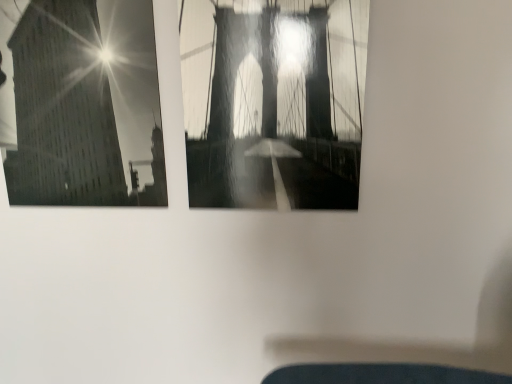
Question: From a real-world perspective, is metallic bridge at center, the second window in the left-to-right sequence, located beneath smooth glass building at upper left, the 1th window in the left-to-right sequence?

Choices:
 (A) yes
 (B) no

Answer: (A)

Question: From a real-world perspective, is metallic bridge at center, marked as the 1th window in a right-to-left arrangement, over smooth glass building at upper left, which appears as the second window when viewed from the right?

Choices:
 (A) no
 (B) yes

Answer: (A)

Question: Considering the relative sizes of metallic bridge at center, the second window in the left-to-right sequence, and smooth glass building at upper left, the 1th window in the left-to-right sequence, in the image provided, is metallic bridge at center, the second window in the left-to-right sequence, taller than smooth glass building at upper left, the 1th window in the left-to-right sequence,?

Choices:
 (A) no
 (B) yes

Answer: (A)

Question: Is metallic bridge at center, the second window in the left-to-right sequence, outside of smooth glass building at upper left, which appears as the second window when viewed from the right?

Choices:
 (A) yes
 (B) no

Answer: (A)

Question: Is metallic bridge at center, marked as the 1th window in a right-to-left arrangement, smaller than smooth glass building at upper left, which appears as the second window when viewed from the right?

Choices:
 (A) no
 (B) yes

Answer: (B)

Question: Is metallic bridge at center, the second window in the left-to-right sequence, bigger than smooth glass building at upper left, the 1th window in the left-to-right sequence?

Choices:
 (A) yes
 (B) no

Answer: (B)

Question: From the image's perspective, is smooth glass building at upper left, which appears as the second window when viewed from the right, located above metallic bridge at center, the second window in the left-to-right sequence?

Choices:
 (A) yes
 (B) no

Answer: (A)

Question: Considering the relative sizes of smooth glass building at upper left, which appears as the second window when viewed from the right, and metallic bridge at center, marked as the 1th window in a right-to-left arrangement, in the image provided, is smooth glass building at upper left, which appears as the second window when viewed from the right, shorter than metallic bridge at center, marked as the 1th window in a right-to-left arrangement,?

Choices:
 (A) no
 (B) yes

Answer: (A)

Question: Is smooth glass building at upper left, which appears as the second window when viewed from the right, facing away from metallic bridge at center, marked as the 1th window in a right-to-left arrangement?

Choices:
 (A) no
 (B) yes

Answer: (A)

Question: Would you say smooth glass building at upper left, the 1th window in the left-to-right sequence, contains metallic bridge at center, the second window in the left-to-right sequence?

Choices:
 (A) yes
 (B) no

Answer: (B)

Question: From a real-world perspective, is smooth glass building at upper left, which appears as the second window when viewed from the right, positioned under metallic bridge at center, the second window in the left-to-right sequence, based on gravity?

Choices:
 (A) yes
 (B) no

Answer: (B)

Question: Can you confirm if smooth glass building at upper left, which appears as the second window when viewed from the right, is taller than metallic bridge at center, marked as the 1th window in a right-to-left arrangement?

Choices:
 (A) no
 (B) yes

Answer: (B)

Question: Does point (108, 97) appear closer or farther from the camera than point (328, 127)?

Choices:
 (A) farther
 (B) closer

Answer: (A)